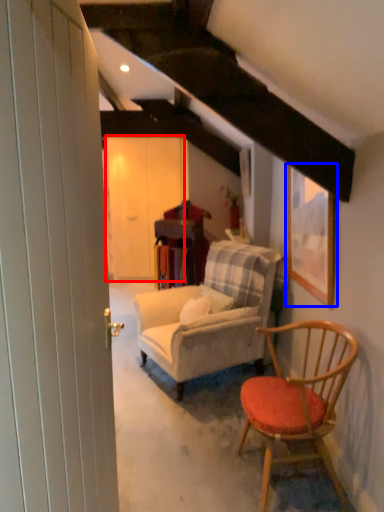
Question: Which point is further to the camera, barn door (highlighted by a red box) or picture frame (highlighted by a blue box)?

Choices:
 (A) barn door
 (B) picture frame

Answer: (A)